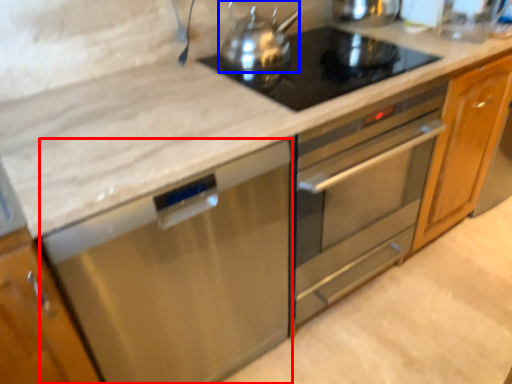
Question: Which object appears closest to the camera in this image, dish washer (highlighted by a red box) or kitchen appliance (highlighted by a blue box)?

Choices:
 (A) dish washer
 (B) kitchen appliance

Answer: (A)